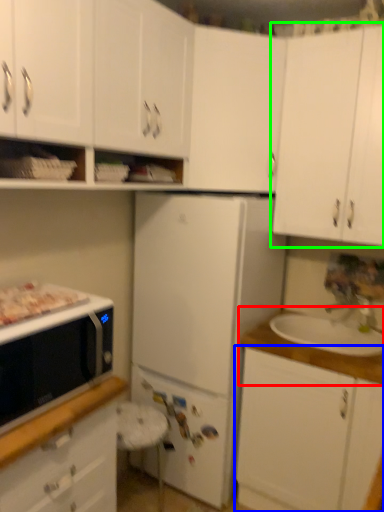
Question: Based on their relative distances, which object is farther from countertop (highlighted by a red box)? Choose from cabinetry (highlighted by a blue box) and cabinetry (highlighted by a green box).

Choices:
 (A) cabinetry
 (B) cabinetry

Answer: (B)